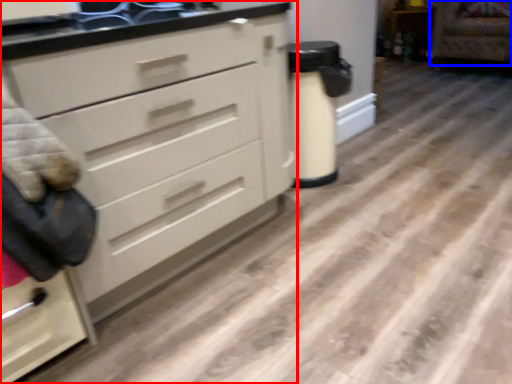
Question: Which of the following is the closest to the observer, chest of drawers (highlighted by a red box) or armchair (highlighted by a blue box)?

Choices:
 (A) chest of drawers
 (B) armchair

Answer: (A)